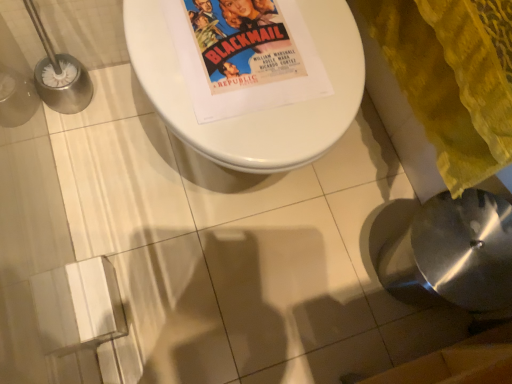
Question: Is yellow textured blanket at lower right aimed at white glossy toilet at center?

Choices:
 (A) no
 (B) yes

Answer: (B)

Question: Is there a large distance between yellow textured blanket at lower right and white glossy toilet at center?

Choices:
 (A) yes
 (B) no

Answer: (B)

Question: From a real-world perspective, is yellow textured blanket at lower right on white glossy toilet at center?

Choices:
 (A) yes
 (B) no

Answer: (A)

Question: From the image's perspective, is yellow textured blanket at lower right over white glossy toilet at center?

Choices:
 (A) no
 (B) yes

Answer: (B)

Question: Does yellow textured blanket at lower right come in front of white glossy toilet at center?

Choices:
 (A) yes
 (B) no

Answer: (A)

Question: Considering the positions of satin silver sink at lower right and white glossy toilet at center in the image, is satin silver sink at lower right taller or shorter than white glossy toilet at center?

Choices:
 (A) short
 (B) tall

Answer: (B)

Question: Based on their sizes in the image, would you say satin silver sink at lower right is bigger or smaller than white glossy toilet at center?

Choices:
 (A) small
 (B) big

Answer: (A)

Question: Is satin silver sink at lower right in front of or behind white glossy toilet at center in the image?

Choices:
 (A) front
 (B) behind

Answer: (B)

Question: Is satin silver sink at lower right to the left or to the right of white glossy toilet at center in the image?

Choices:
 (A) right
 (B) left

Answer: (A)

Question: Considering their positions, is yellow textured blanket at lower right located in front of or behind satin silver sink at lower right?

Choices:
 (A) behind
 (B) front

Answer: (B)

Question: In terms of size, does yellow textured blanket at lower right appear bigger or smaller than satin silver sink at lower right?

Choices:
 (A) small
 (B) big

Answer: (B)

Question: Is yellow textured blanket at lower right to the left or to the right of satin silver sink at lower right in the image?

Choices:
 (A) left
 (B) right

Answer: (A)

Question: Considering the positions of yellow textured blanket at lower right and satin silver sink at lower right in the image, is yellow textured blanket at lower right taller or shorter than satin silver sink at lower right?

Choices:
 (A) tall
 (B) short

Answer: (B)

Question: From the image's perspective, is yellow textured blanket at lower right above or below white glossy toilet at center?

Choices:
 (A) below
 (B) above

Answer: (B)

Question: Considering the positions of yellow textured blanket at lower right and white glossy toilet at center in the image, is yellow textured blanket at lower right taller or shorter than white glossy toilet at center?

Choices:
 (A) tall
 (B) short

Answer: (A)